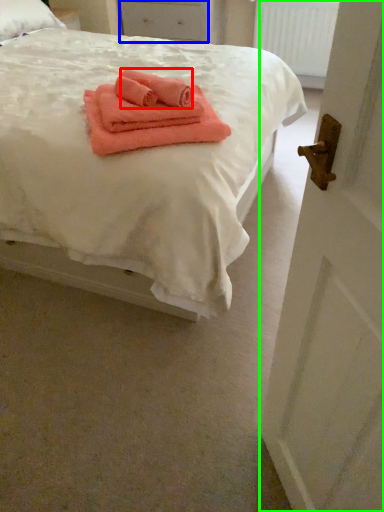
Question: Considering the real-world distances, which object is closest to cloth (highlighted by a red box)? drawer (highlighted by a blue box) or door (highlighted by a green box).

Choices:
 (A) drawer
 (B) door

Answer: (B)